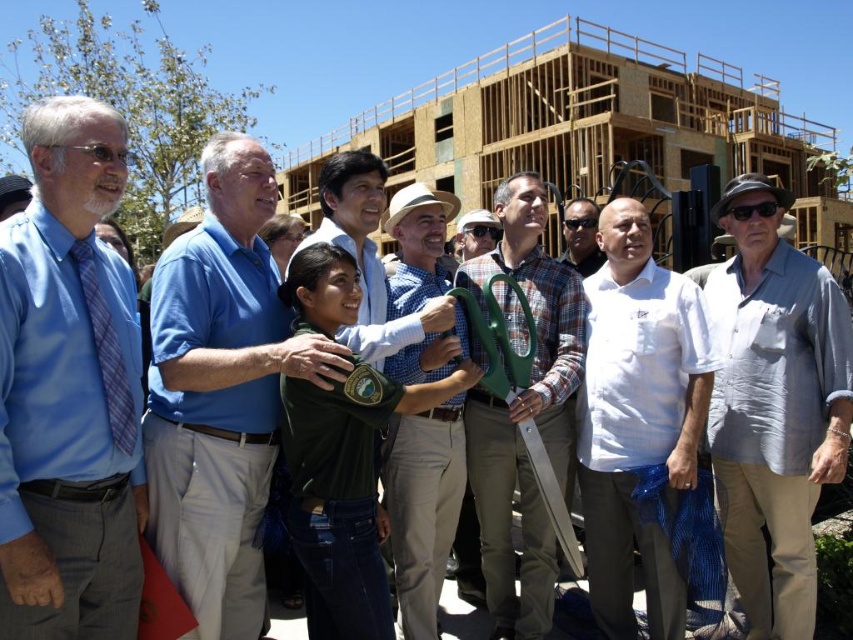
Question: Which point is closer to the camera?

Choices:
 (A) white cotton shirt at center
 (B) green uniform at center

Answer: (A)

Question: Is blue shirt at center to the left of gray silk shirt at right from the viewer's perspective?

Choices:
 (A) yes
 (B) no

Answer: (A)

Question: Which object appears closest to the camera in this image?

Choices:
 (A) gray silk shirt at right
 (B) blue shirt at center
 (C) white cotton shirt at center

Answer: (B)

Question: Which point is farther to the camera?

Choices:
 (A) blue plaid tie at left
 (B) gray silk shirt at right

Answer: (B)

Question: From the image, what is the correct spatial relationship of plaid fabric shirt at center in relation to green matte watering can at center?

Choices:
 (A) left
 (B) right

Answer: (B)

Question: Does white cotton shirt at center appear under blue plaid tie at left?

Choices:
 (A) no
 (B) yes

Answer: (B)